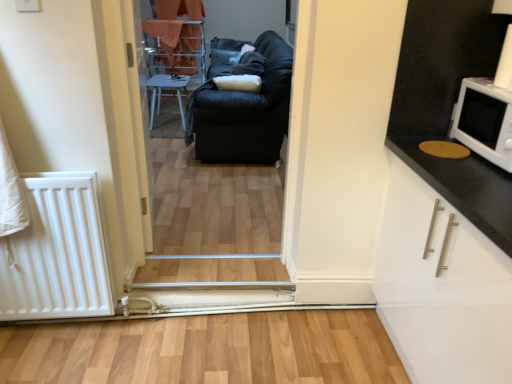
This screenshot has width=512, height=384. Describe the element at coordinates (161, 93) in the screenshot. I see `white plastic chair at center` at that location.

Image resolution: width=512 pixels, height=384 pixels. What do you see at coordinates (220, 202) in the screenshot?
I see `black leather couch at center` at bounding box center [220, 202].

What do you see at coordinates (445, 269) in the screenshot? The height and width of the screenshot is (384, 512). I see `white glossy cabinet at right` at bounding box center [445, 269].

Locate an element on the screen. white glossy cabinet at right is located at coordinates (445, 269).

You are a GUI agent. You are given a task and a screenshot of the screen. Output one action in this format:
    pyautogui.click(x=<x>, y=<y>)
    Task: Click on the white glossy microwave at upper right
    The width and height of the screenshot is (512, 384).
    Given the screenshot: What is the action you would take?
    pyautogui.click(x=484, y=120)

How many degrees apart are the facing directions of white glossy cabinet at right and orange fabric bunk bed at upper left?

87.5 degrees separate the facing orientations of white glossy cabinet at right and orange fabric bunk bed at upper left.

Is white glossy cabinet at right facing away from orange fabric bunk bed at upper left?

No, white glossy cabinet at right's orientation is not away from orange fabric bunk bed at upper left.

Considering the positions of points (396, 202) and (190, 59), is point (396, 202) closer to camera compared to point (190, 59)?

Yes.

From the image's perspective, which is above, white glossy cabinet at right or orange fabric bunk bed at upper left?

orange fabric bunk bed at upper left is shown above in the image.

In the scene shown: Is white glossy cabinet at right smaller than black leather couch at center?

Indeed, white glossy cabinet at right has a smaller size compared to black leather couch at center.

Which is more to the right, white glossy cabinet at right or black leather couch at center?

From the viewer's perspective, white glossy cabinet at right appears more on the right side.

Would you consider white glossy cabinet at right to be distant from black leather couch at center?

That's right, there is a large distance between white glossy cabinet at right and black leather couch at center.

Is white glossy cabinet at right not inside black leather couch at center?

Yes, white glossy cabinet at right is not within black leather couch at center.

In the image, is white plastic chair at center positioned in front of or behind white wood door at center?

Visually, white plastic chair at center is located behind white wood door at center.

Locate an element on the screen. door in front of the white plastic chair at center is located at coordinates (139, 111).

Is white plastic chair at center touching white wood door at center?

No, white plastic chair at center is not touching white wood door at center.

Which is correct: white plastic chair at center is inside white wood door at center, or outside of it?

white plastic chair at center exists outside the volume of white wood door at center.

Are white plastic chair at center and orange fabric bunk bed at upper left making contact?

They are not placed beside each other.

This screenshot has height=384, width=512. Identify the location of bunk bed located above the white plastic chair at center (from the image's perspective). (176, 34).

From the image's perspective, is white plastic chair at center on orange fabric bunk bed at upper left?

No.

Can you confirm if white plastic chair at center is positioned to the right of orange fabric bunk bed at upper left?

Yes.

Is black leather couch at center turned away from white plastic chair at center?

Yes, black leather couch at center's orientation is away from white plastic chair at center.

From the image's perspective, is black leather couch at center located above white plastic chair at center?

Indeed, from the image's perspective, black leather couch at center is shown above white plastic chair at center.

Does point (274, 127) lie in front of point (162, 87)?

Yes, point (274, 127) is closer to viewer.

Can you see white wood door at center touching black leather couch at center?

No, white wood door at center is not next to black leather couch at center.

Is white wood door at center taller than black leather couch at center?

No.

Consider the image. From the image's perspective, does white wood door at center appear higher than black leather couch at center?

Yes, from the image's perspective, white wood door at center is above black leather couch at center.

Can you confirm if white wood door at center is smaller than black leather couch at center?

No.

Can you confirm if white glossy cabinet at right is positioned to the left of black leather couch at center?

Incorrect, white glossy cabinet at right is not on the left side of black leather couch at center.

Consider the image. Which object is further away from the camera taking this photo, white glossy cabinet at right or black leather couch at center?

black leather couch at center is further away from the camera.

From a real-world perspective, is white glossy cabinet at right on top of black leather couch at center?

No, from a real-world perspective, white glossy cabinet at right is not on top of black leather couch at center.

This screenshot has height=384, width=512. Identify the location of bunk bed above the white glossy cabinet at right (from the image's perspective). (176, 34).

Find the location of a particular element. The width and height of the screenshot is (512, 384). cabinetry below the black leather couch at center (from the image's perspective) is located at coordinates (445, 269).

From the image, which object appears to be nearer to white matte radiator at lower left, white glossy microwave at upper right or white plastic chair at center?

white glossy microwave at upper right is closer to white matte radiator at lower left.

When comparing their distances from black leather couch at center, does white wood door at center or white glossy microwave at upper right seem closer?

The object closer to black leather couch at center is white wood door at center.

Estimate the real-world distances between objects in this image. Which object is further from white glossy microwave at upper right, orange fabric bunk bed at upper left or white matte radiator at lower left?

The object further to white glossy microwave at upper right is orange fabric bunk bed at upper left.

When comparing their distances from white glossy microwave at upper right, does white plastic chair at center or orange fabric bunk bed at upper left seem closer?

Among the two, white plastic chair at center is located nearer to white glossy microwave at upper right.

Looking at the image, which one is located further to white glossy microwave at upper right, white wood door at center or white glossy cabinet at right?

Based on the image, white wood door at center appears to be further to white glossy microwave at upper right.

Looking at the image, which one is located further to white wood door at center, white glossy microwave at upper right or white glossy cabinet at right?

white glossy microwave at upper right lies further to white wood door at center than the other object.

When comparing their distances from white wood door at center, does white plastic chair at center or black leather couch at center seem closer?

black leather couch at center is positioned closer to the anchor white wood door at center.

Looking at the image, which one is located further to white plastic chair at center, black leather couch at center or white matte radiator at lower left?

Based on the image, white matte radiator at lower left appears to be further to white plastic chair at center.

Find the location of a particular element. appliance between white glossy cabinet at right and black leather couch at center from front to back is located at coordinates (484, 120).

You are a GUI agent. You are given a task and a screenshot of the screen. Output one action in this format:
    pyautogui.click(x=<x>, y=<y>)
    Task: Click on the radiator positioned between white glossy microwave at upper right and black leather couch at center from near to far
    This screenshot has width=512, height=384.
    Given the screenshot: What is the action you would take?
    pyautogui.click(x=56, y=253)

Locate an element on the screen. radiator positioned between white glossy cabinet at right and black leather couch at center from near to far is located at coordinates (56, 253).

This screenshot has width=512, height=384. Identify the location of studio couch located between white glossy cabinet at right and orange fabric bunk bed at upper left in the depth direction. pyautogui.click(x=244, y=112).